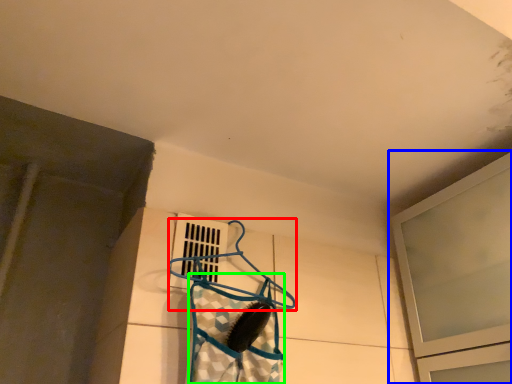
Question: Which is farther away from hanger (highlighted by a red box)? window (highlighted by a blue box) or clothing (highlighted by a green box)?

Choices:
 (A) window
 (B) clothing

Answer: (A)